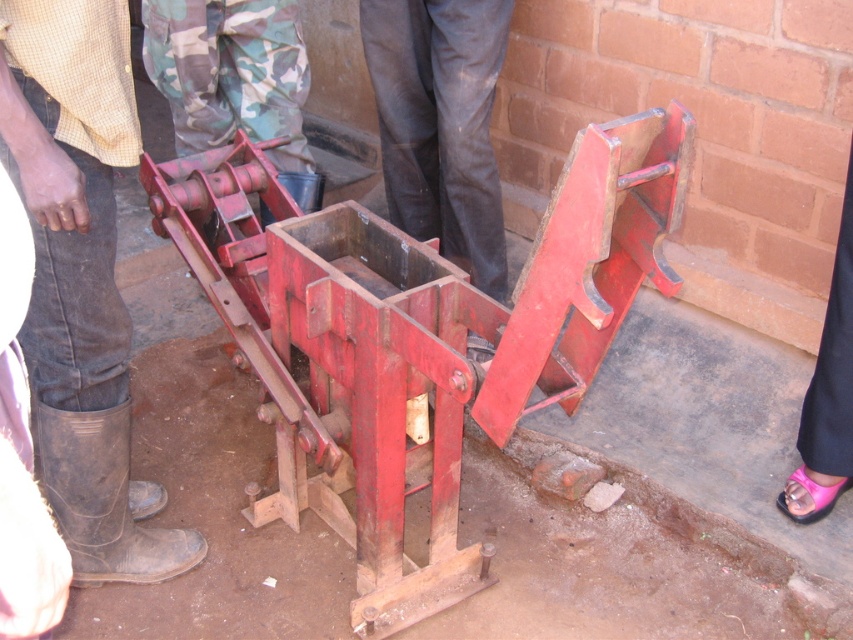
Consider the image. Can you confirm if rusty metal press at center is shorter than brown leather boots at lower left?

Yes, rusty metal press at center is shorter than brown leather boots at lower left.

Is point (639, 131) more distant than point (51, 416)?

No, (639, 131) is in front of (51, 416).

Locate an element on the screen. This screenshot has width=853, height=640. rusty metal press at center is located at coordinates pos(415,337).

Where is `pink leather sandal at lower right`? This screenshot has width=853, height=640. pink leather sandal at lower right is located at coordinates (827, 394).

Which is more to the right, pink leather sandal at lower right or pink fabric sandal at lower right?

pink leather sandal at lower right

Does point (850, 225) come farther from viewer compared to point (805, 483)?

No, (850, 225) is closer to viewer.

This screenshot has height=640, width=853. Identify the location of pink leather sandal at lower right. (827, 394).

Does rusty metal press at center appear on the left side of pink fabric sandal at lower right?

Indeed, rusty metal press at center is positioned on the left side of pink fabric sandal at lower right.

Which is behind, point (656, 221) or point (846, 488)?

The point (846, 488) is more distant.

The width and height of the screenshot is (853, 640). What do you see at coordinates (415, 337) in the screenshot?
I see `rusty metal press at center` at bounding box center [415, 337].

Where is `rusty metal press at center`? rusty metal press at center is located at coordinates (415, 337).